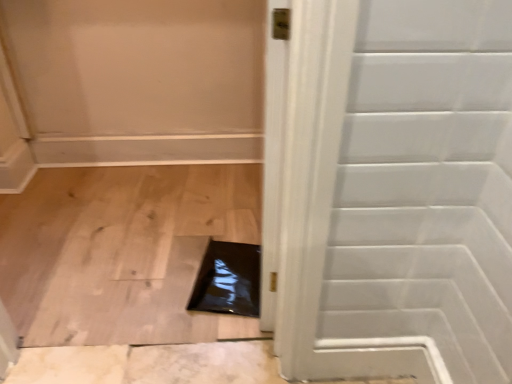
I want to click on free point above black glossy hole at center (from a real-world perspective), so click(222, 266).